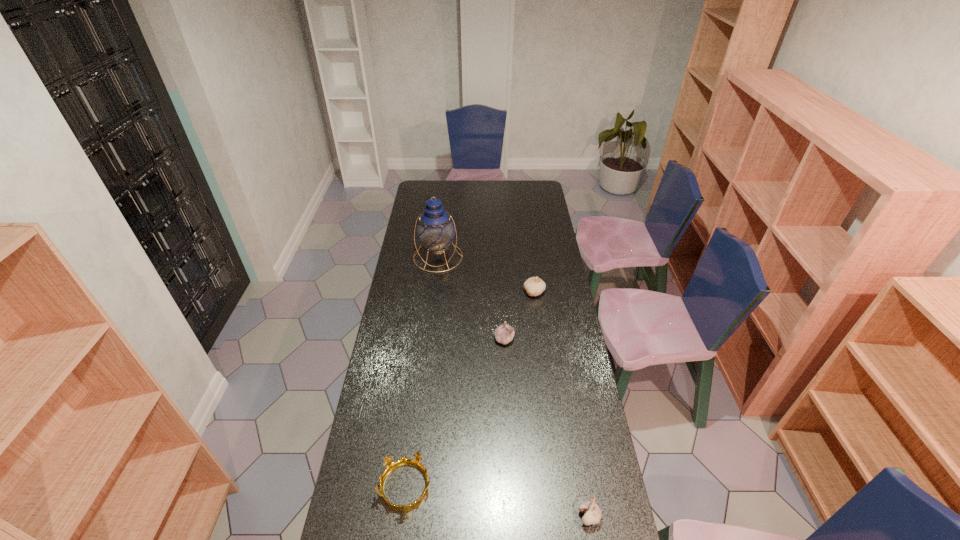
Where is `lantern`? lantern is located at coordinates (435, 229).

Identify the location of the tallest object. This screenshot has width=960, height=540. (435, 229).

I want to click on the third object from left to right, so click(504, 334).

Where is `the leftmost garlic`? The height and width of the screenshot is (540, 960). the leftmost garlic is located at coordinates (504, 334).

Where is `the fourth nearest object`? the fourth nearest object is located at coordinates (534, 286).

I want to click on the second shortest object, so click(x=592, y=514).

This screenshot has width=960, height=540. I want to click on the shortest garlic, so click(x=592, y=514).

This screenshot has width=960, height=540. I want to click on crown, so click(x=391, y=466).

At what (x,y) coordinates should I click in order to perform the action: click on free space located on the front-facing side of the farthest object. Please return your answer as a coordinate pair (x, y). The height and width of the screenshot is (540, 960). Looking at the image, I should click on (431, 316).

Locate an element on the screen. This screenshot has height=540, width=960. vacant region located 0.110m on the left of the third farthest object is located at coordinates (468, 339).